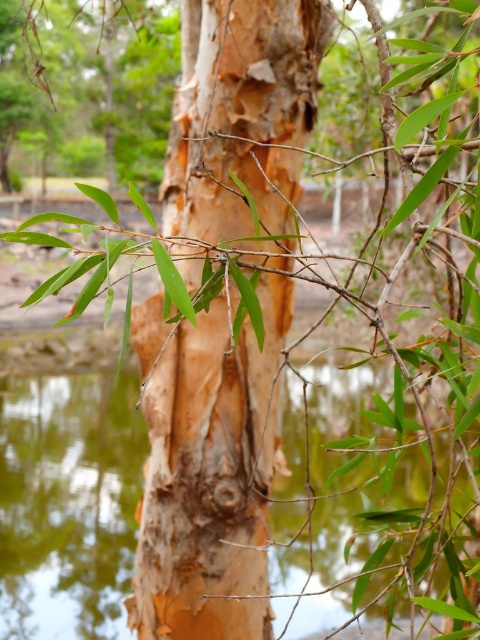
Does smooth brown bark at center have a lesser width compared to green reflective water at center?

Correct, smooth brown bark at center's width is less than green reflective water at center's.

Is smooth brown bark at center smaller than green reflective water at center?

Yes.

Is point (268, 324) behind point (60, 451)?

No, (268, 324) is closer to viewer.

You are a GUI agent. You are given a task and a screenshot of the screen. Output one action in this format:
    pyautogui.click(x=<x>, y=<y>)
    Task: Click on the smooth brown bark at center
    Image resolution: width=480 pixels, height=640 pixels.
    Given the screenshot: What is the action you would take?
    pyautogui.click(x=210, y=477)